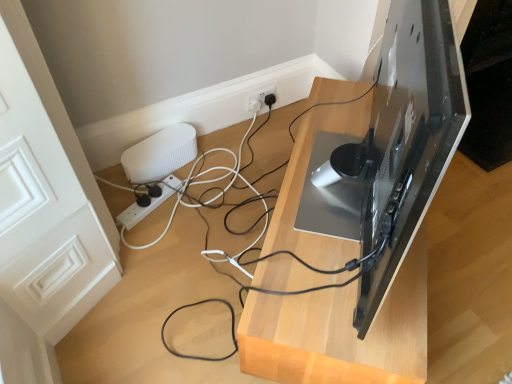
Where is `white plastic power strip at lower center`? white plastic power strip at lower center is located at coordinates (150, 203).

This screenshot has width=512, height=384. In order to click on black glossy tv stand at upper right in this screenshot , I will do `click(340, 332)`.

Relative to white plastic power strip at lower center, is white ribbed speaker at lower left in front or behind?

In the image, white ribbed speaker at lower left appears behind white plastic power strip at lower center.

From a real-world perspective, is white ribbed speaker at lower left positioned above or below white plastic power strip at lower center?

From a real-world perspective, white ribbed speaker at lower left is physically above white plastic power strip at lower center.

Measure the distance between white ribbed speaker at lower left and white plastic power strip at lower center.

4.70 inches.

From the image's perspective, between white ribbed speaker at lower left and white plastic power strip at lower center, which one is located above?

white ribbed speaker at lower left.

From a real-world perspective, is white plastic power strip at lower center physically located above or below black glossy tv stand at upper right?

In terms of real-world spatial position, white plastic power strip at lower center is below black glossy tv stand at upper right.

From the image's perspective, between white plastic power strip at lower center and black glossy tv stand at upper right, who is located below?

black glossy tv stand at upper right, from the image's perspective.

Can you confirm if white plastic power strip at lower center is thinner than black glossy tv stand at upper right?

Correct, the width of white plastic power strip at lower center is less than that of black glossy tv stand at upper right.

What's the angular difference between white plastic power strip at lower center and black glossy tv stand at upper right's facing directions?

They differ by 23.5 degrees in their facing directions.

Locate an element on the screen. This screenshot has height=384, width=512. appliance below the black glossy tv stand at upper right (from a real-world perspective) is located at coordinates (160, 154).

From a real-world perspective, is white ribbed speaker at lower left under black glossy tv stand at upper right?

Yes, from a real-world perspective, white ribbed speaker at lower left is under black glossy tv stand at upper right.

Based on their sizes in the image, would you say white ribbed speaker at lower left is bigger or smaller than black glossy tv stand at upper right?

In the image, white ribbed speaker at lower left appears to be smaller than black glossy tv stand at upper right.

Could you tell me if white ribbed speaker at lower left is turned towards black glossy tv stand at upper right?

Yes, white ribbed speaker at lower left is aimed at black glossy tv stand at upper right.

Can you confirm if white plastic power strip at lower center is taller than white ribbed speaker at lower left?

No, white plastic power strip at lower center is not taller than white ribbed speaker at lower left.

Can you confirm if white plastic power strip at lower center is smaller than white ribbed speaker at lower left?

Yes.

In the image, is white plastic power strip at lower center on the left side or the right side of white ribbed speaker at lower left?

Clearly, white plastic power strip at lower center is on the left of white ribbed speaker at lower left in the image.

Based on the photo, is white plastic power strip at lower center with white ribbed speaker at lower left?

No, white plastic power strip at lower center is not next to white ribbed speaker at lower left.

Can we say black glossy tv stand at upper right lies outside glossy black monitor at upper right?

Indeed, black glossy tv stand at upper right is completely outside glossy black monitor at upper right.

The image size is (512, 384). Identify the location of desktop computer lying above the black glossy tv stand at upper right (from the image's perspective). (402, 142).

From a real-world perspective, does black glossy tv stand at upper right stand above glossy black monitor at upper right?

No.

Looking at this image, is black glossy tv stand at upper right looking in the opposite direction of glossy black monitor at upper right?

A: That's not correct — black glossy tv stand at upper right is not looking away from glossy black monitor at upper right.

Based on the photo, which of these two, white ribbed speaker at lower left or glossy black monitor at upper right, stands taller?

With more height is glossy black monitor at upper right.

From the image's perspective, between white ribbed speaker at lower left and glossy black monitor at upper right, who is located below?

white ribbed speaker at lower left is shown below in the image.

Which of these two, white ribbed speaker at lower left or glossy black monitor at upper right, is wider?

glossy black monitor at upper right is wider.

Is point (169, 168) farther from viewer compared to point (400, 18)?

Yes, it is.

Is white ribbed speaker at lower left located within glossy black monitor at upper right?

No, white ribbed speaker at lower left is not surrounded by glossy black monitor at upper right.

Who is taller, glossy black monitor at upper right or white ribbed speaker at lower left?

With more height is glossy black monitor at upper right.

Which point is more forward, (x=392, y=267) or (x=162, y=148)?

The point (x=392, y=267) is closer.

How different are the orientations of glossy black monitor at upper right and white ribbed speaker at lower left in degrees?

26.8 degrees separate the facing orientations of glossy black monitor at upper right and white ribbed speaker at lower left.

I want to click on extension cord in front of the white ribbed speaker at lower left, so click(x=150, y=203).

The height and width of the screenshot is (384, 512). What are the coordinates of `furniture above the white plastic power strip at lower center (from a real-world perspective)` in the screenshot? It's located at (340, 332).

From the image, which object appears to be farther from white plastic power strip at lower center, white ribbed speaker at lower left or black glossy tv stand at upper right?

black glossy tv stand at upper right lies further to white plastic power strip at lower center than the other object.

Looking at the image, which one is located further to black glossy tv stand at upper right, white plastic power strip at lower center or glossy black monitor at upper right?

Based on the image, white plastic power strip at lower center appears to be further to black glossy tv stand at upper right.

Considering their positions, is black glossy tv stand at upper right positioned further to glossy black monitor at upper right than white plastic power strip at lower center?

white plastic power strip at lower center.

Looking at the image, which one is located further to glossy black monitor at upper right, white plastic power strip at lower center or black glossy tv stand at upper right?

white plastic power strip at lower center is positioned further to the anchor glossy black monitor at upper right.

When comparing their distances from white ribbed speaker at lower left, does white plastic power strip at lower center or glossy black monitor at upper right seem further?

glossy black monitor at upper right is further to white ribbed speaker at lower left.

Which object lies nearer to the anchor point white plastic power strip at lower center, black glossy tv stand at upper right or white ribbed speaker at lower left?

Among the two, white ribbed speaker at lower left is located nearer to white plastic power strip at lower center.

Considering their positions, is black glossy tv stand at upper right positioned closer to white plastic power strip at lower center than glossy black monitor at upper right?

black glossy tv stand at upper right is closer to white plastic power strip at lower center.

Considering their positions, is black glossy tv stand at upper right positioned further to glossy black monitor at upper right than white ribbed speaker at lower left?

white ribbed speaker at lower left is positioned further to the anchor glossy black monitor at upper right.

Where is `furniture between glossy black monitor at upper right and white ribbed speaker at lower left from front to back`? Image resolution: width=512 pixels, height=384 pixels. furniture between glossy black monitor at upper right and white ribbed speaker at lower left from front to back is located at coordinates (340, 332).

Identify the location of extension cord positioned between black glossy tv stand at upper right and white ribbed speaker at lower left from near to far. [x=150, y=203].

Where is `extension cord between glossy black monitor at upper right and white ribbed speaker at lower left from front to back`? The height and width of the screenshot is (384, 512). extension cord between glossy black monitor at upper right and white ribbed speaker at lower left from front to back is located at coordinates (150, 203).

Identify the location of furniture located between glossy black monitor at upper right and white plastic power strip at lower center in the depth direction. (340, 332).